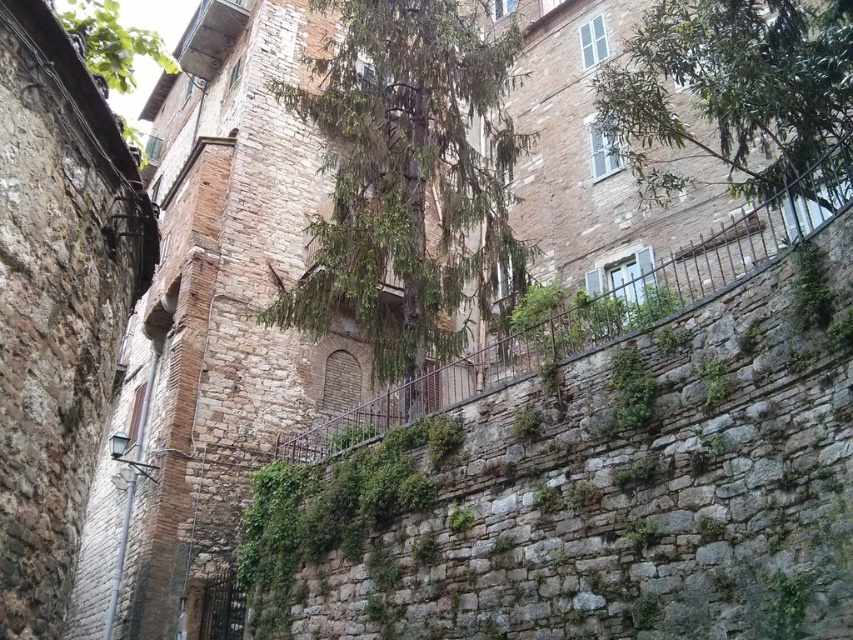
Question: Which of the following is the farthest from the observer?

Choices:
 (A) (636, 33)
 (B) (399, 202)

Answer: (A)

Question: Does green leafy tree at center appear on the left side of green leafy tree at upper center?

Choices:
 (A) yes
 (B) no

Answer: (A)

Question: Can you confirm if green leafy tree at center is wider than green leafy tree at upper center?

Choices:
 (A) yes
 (B) no

Answer: (A)

Question: Does green leafy tree at center appear under green leafy tree at upper center?

Choices:
 (A) no
 (B) yes

Answer: (A)

Question: Which point is closer to the camera?

Choices:
 (A) (415, 192)
 (B) (727, 77)

Answer: (B)